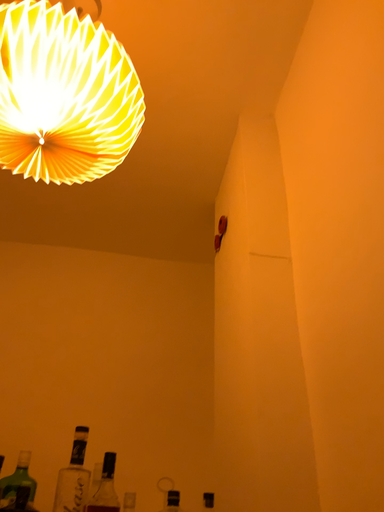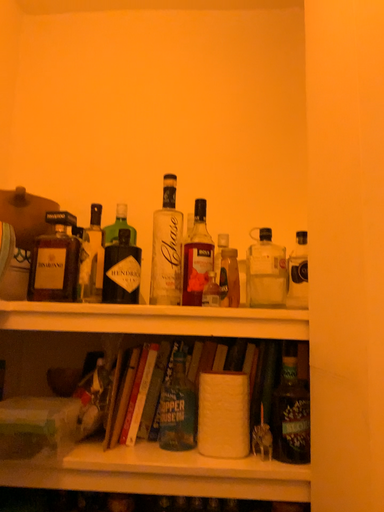
Question: How did the camera likely rotate when shooting the video?

Choices:
 (A) rotated upward
 (B) rotated downward

Answer: (B)